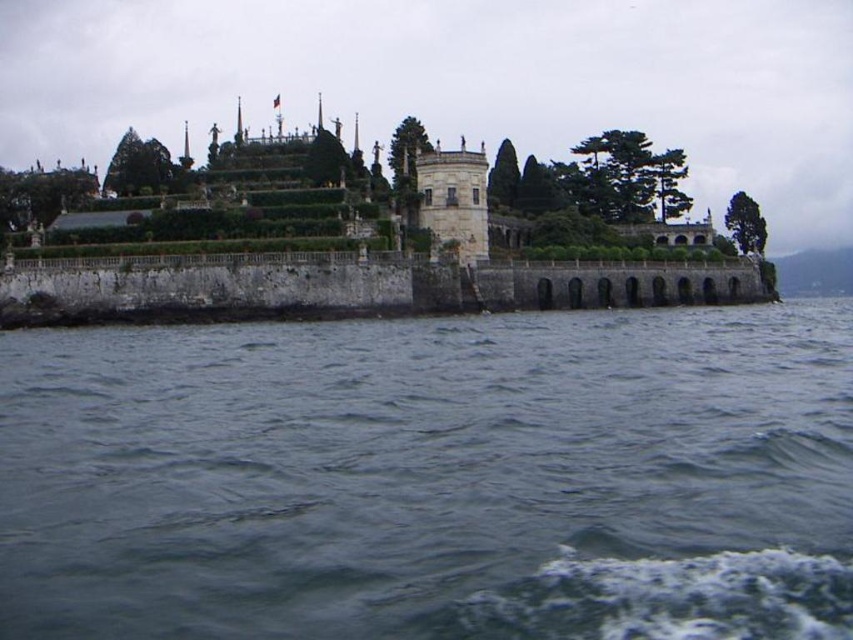
Question: Where is green leafy tree at upper left located in relation to green textured tree at upper right in the image?

Choices:
 (A) left
 (B) right

Answer: (A)

Question: Is green leafy tree at upper left below green textured tree at center?

Choices:
 (A) yes
 (B) no

Answer: (A)

Question: Estimate the real-world distances between objects in this image. Which object is farther from the green leafy tree at upper left?

Choices:
 (A) green textured tree at center
 (B) green leafy tree at center
 (C) green textured tree at upper right
 (D) green leafy tree at upper center

Answer: (C)

Question: Considering the real-world distances, which object is farthest from the green textured trees at upper center?

Choices:
 (A) green leafy tree at upper center
 (B) green textured tree at center

Answer: (A)

Question: Which point is closer to the camera taking this photo?

Choices:
 (A) (743, 243)
 (B) (15, 198)

Answer: (B)

Question: Does green textured trees at upper center have a smaller size compared to green textured tree at upper right?

Choices:
 (A) no
 (B) yes

Answer: (A)